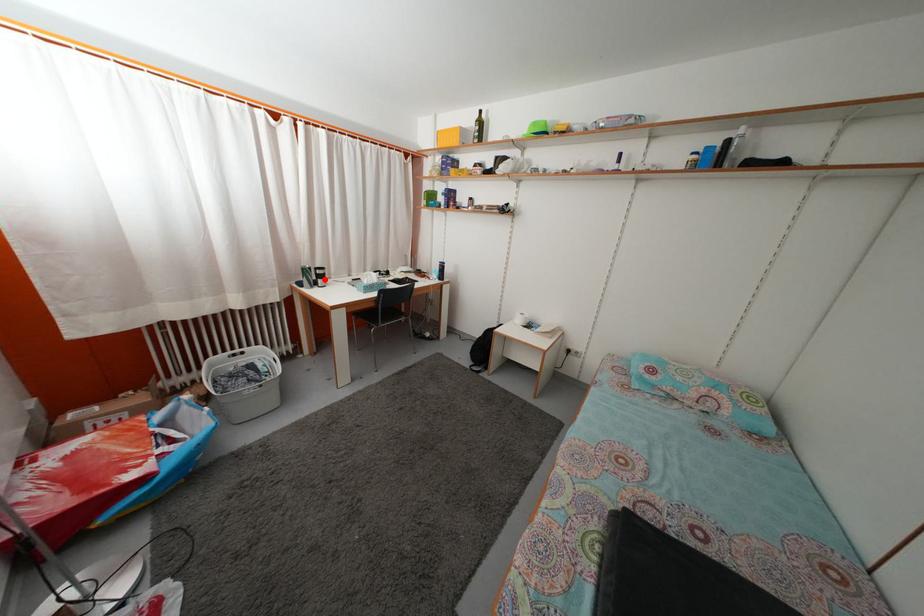
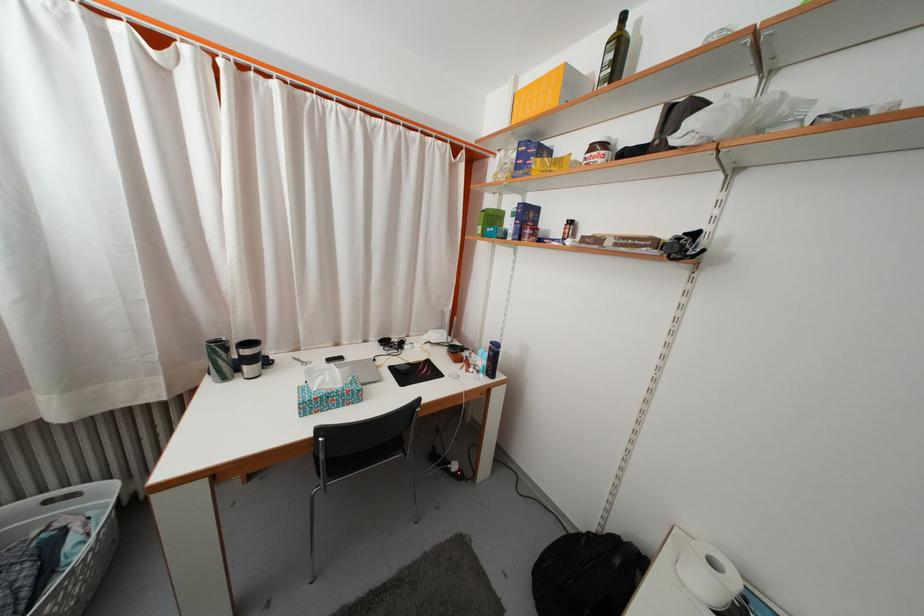
Find the pixel in the second image that matches the highlighted location in the first image.

(251, 359)